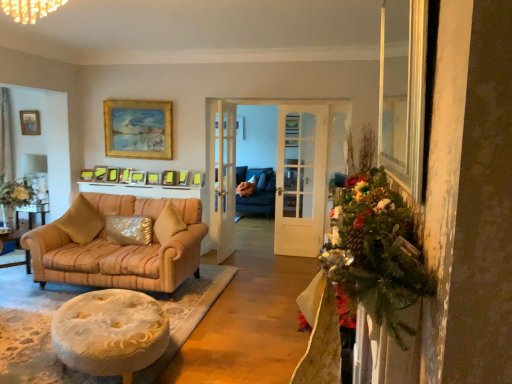
Question: Is matte gold picture frame at center, the fifth picture frame in the left-to-right sequence, far away from matte gold picture frame at upper center, which is counted as the 8th picture frame, starting from the right?

Choices:
 (A) yes
 (B) no

Answer: (B)

Question: Is matte gold picture frame at center, acting as the 6th picture frame starting from the right, in front of matte gold picture frame at upper center, which is the 3th picture frame in left-to-right order?

Choices:
 (A) yes
 (B) no

Answer: (A)

Question: Is matte gold picture frame at upper center, which is the 3th picture frame in left-to-right order, inside matte gold picture frame at center, acting as the 6th picture frame starting from the right?

Choices:
 (A) no
 (B) yes

Answer: (A)

Question: Is matte gold picture frame at center, the fifth picture frame in the left-to-right sequence, thinner than matte gold picture frame at upper center, which is the 3th picture frame in left-to-right order?

Choices:
 (A) yes
 (B) no

Answer: (A)

Question: Is matte gold picture frame at center, acting as the 6th picture frame starting from the right, further to camera compared to matte gold picture frame at upper center, which is counted as the 8th picture frame, starting from the right?

Choices:
 (A) yes
 (B) no

Answer: (B)

Question: Is matte gold picture frame at center, acting as the 6th picture frame starting from the right, taller than matte gold picture frame at upper center, which is counted as the 8th picture frame, starting from the right?

Choices:
 (A) yes
 (B) no

Answer: (B)

Question: From a real-world perspective, is matte gold picture frame at upper center, which is counted as the 8th picture frame, starting from the right, on top of matte gold picture frame at center, the fourth picture frame from the right?

Choices:
 (A) yes
 (B) no

Answer: (A)

Question: From a real-world perspective, is matte gold picture frame at upper center, which is counted as the 8th picture frame, starting from the right, beneath matte gold picture frame at center, the fourth picture frame from the right?

Choices:
 (A) yes
 (B) no

Answer: (B)

Question: Are matte gold picture frame at upper center, which is the 3th picture frame in left-to-right order, and matte gold picture frame at center, the fourth picture frame from the right, making contact?

Choices:
 (A) yes
 (B) no

Answer: (B)

Question: Is matte gold picture frame at upper center, which is the 3th picture frame in left-to-right order, positioned with its back to matte gold picture frame at center, the fourth picture frame from the right?

Choices:
 (A) yes
 (B) no

Answer: (B)

Question: Is matte gold picture frame at upper center, which is the 3th picture frame in left-to-right order, to the right of matte gold picture frame at center, the seventh picture frame when ordered from left to right, from the viewer's perspective?

Choices:
 (A) no
 (B) yes

Answer: (A)

Question: Does matte gold picture frame at upper center, which is the 3th picture frame in left-to-right order, have a smaller size compared to matte gold picture frame at center, the seventh picture frame when ordered from left to right?

Choices:
 (A) no
 (B) yes

Answer: (A)

Question: Can you confirm if matte gold picture frame at center, the 1th picture frame viewed from the right, is bigger than matte gold picture frame at upper center, which is counted as the 8th picture frame, starting from the right?

Choices:
 (A) no
 (B) yes

Answer: (A)